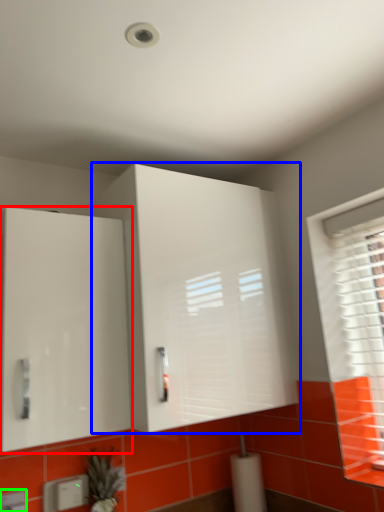
Question: Which object is positioned farthest from cabinetry (highlighted by a red box)? Select from cabinetry (highlighted by a blue box) and electric outlet (highlighted by a green box).

Choices:
 (A) cabinetry
 (B) electric outlet

Answer: (B)